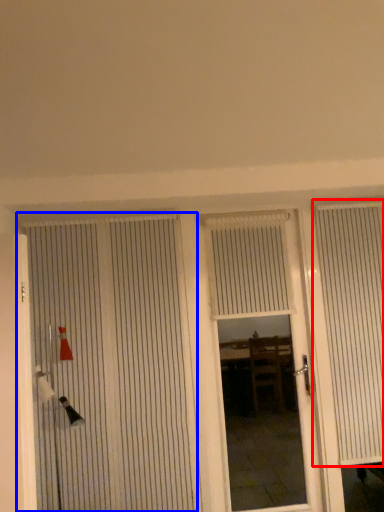
Question: Which object appears closest to the camera in this image, curtain (highlighted by a red box) or door (highlighted by a blue box)?

Choices:
 (A) curtain
 (B) door

Answer: (B)